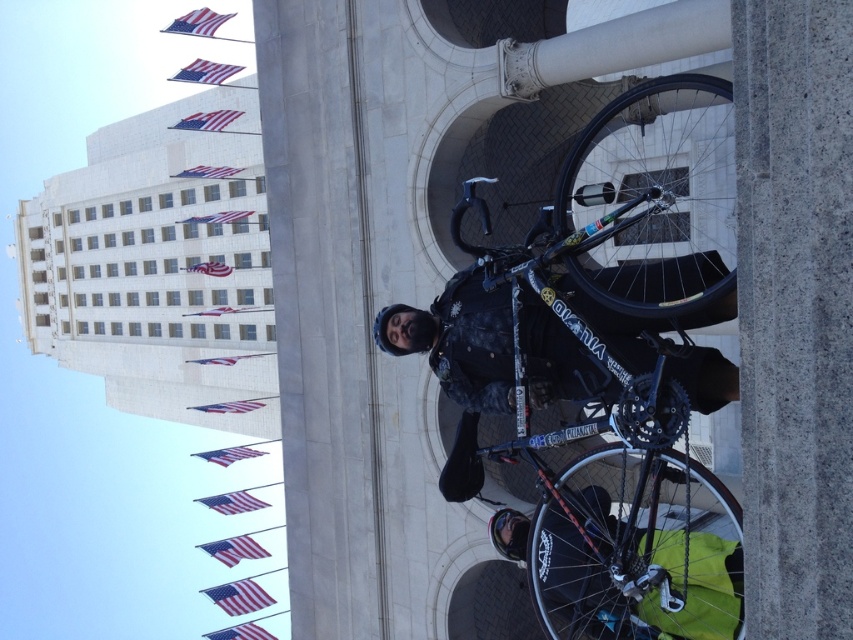
Question: Which of these objects is positioned closest to the shiny black bicycle at center?

Choices:
 (A) shiny black tire at center
 (B) black rubber tire at center
 (C) dark blue fabric jacket at center

Answer: (B)

Question: Does shiny black tire at center appear under dark blue fabric jacket at center?

Choices:
 (A) no
 (B) yes

Answer: (B)

Question: Can you confirm if shiny black bicycle at center is positioned below shiny black tire at center?

Choices:
 (A) no
 (B) yes

Answer: (A)

Question: Based on their relative distances, which object is nearer to the shiny black tire at center?

Choices:
 (A) shiny black bicycle at center
 (B) black rubber tire at center

Answer: (A)

Question: Among these objects, which one is farthest from the camera?

Choices:
 (A) shiny black bicycle at center
 (B) shiny black tire at center

Answer: (A)

Question: Considering the relative positions of shiny black bicycle at center and dark blue fabric jacket at center in the image provided, where is shiny black bicycle at center located with respect to dark blue fabric jacket at center?

Choices:
 (A) below
 (B) above

Answer: (B)